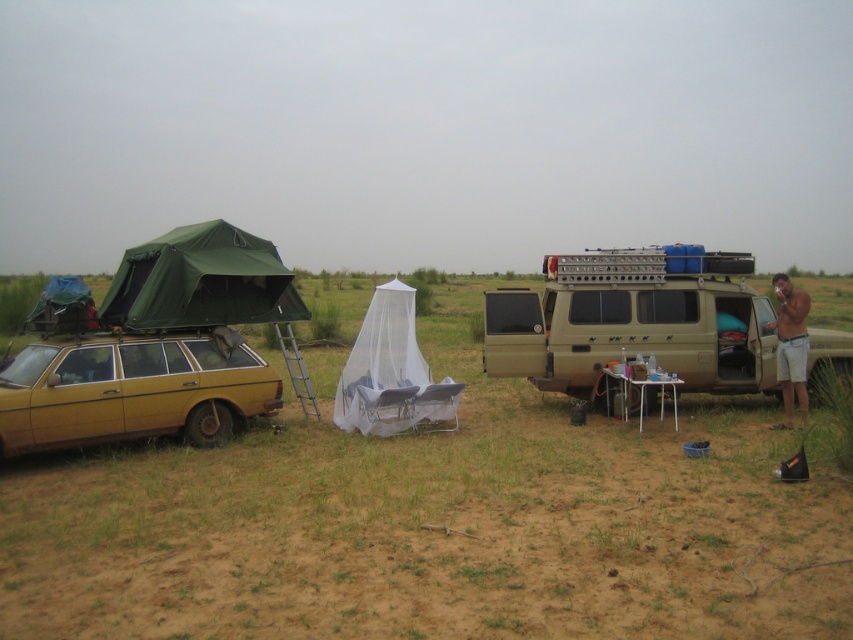
You are planning to park your car next to the matte gold van at center and the green fabric tent at upper left. Which one of these two items has a smaller width?

The matte gold van at center has a smaller width than the green fabric tent at upper left according to the description.